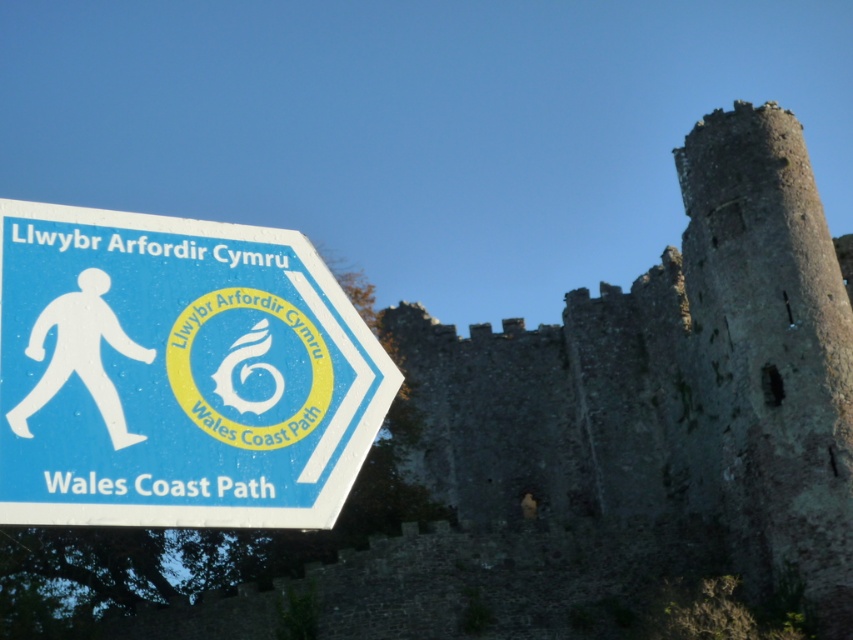
How far apart are gray stone castle at center and blue plastic sign at left?

gray stone castle at center is 60.90 meters from blue plastic sign at left.

Can you confirm if gray stone castle at center is positioned to the left of blue plastic sign at left?

No, gray stone castle at center is not to the left of blue plastic sign at left.

I want to click on gray stone castle at center, so click(674, 378).

Image resolution: width=853 pixels, height=640 pixels. I want to click on gray stone castle at center, so click(x=674, y=378).